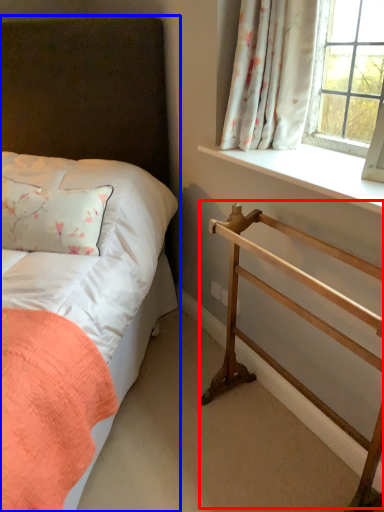
Question: Which object is further to the camera taking this photo, balustrade (highlighted by a red box) or bed (highlighted by a blue box)?

Choices:
 (A) balustrade
 (B) bed

Answer: (A)